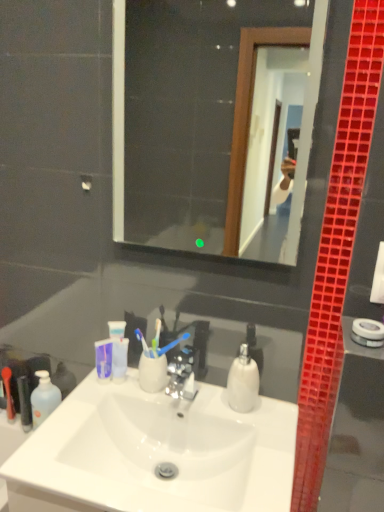
What is the approximate width of transparent glass mirror at upper center?

transparent glass mirror at upper center is 1.23 inches wide.

Describe the element at coordinates (243, 382) in the screenshot. Image resolution: width=384 pixels, height=512 pixels. I see `white glossy soap dispenser at center` at that location.

What do you see at coordinates (8, 393) in the screenshot? This screenshot has height=512, width=384. I see `rubberized red toothbrush at lower left, marked as the 2th toiletry in a right-to-left arrangement` at bounding box center [8, 393].

This screenshot has height=512, width=384. What do you see at coordinates (24, 403) in the screenshot? I see `black plastic tube at left, the second toiletry viewed from the left` at bounding box center [24, 403].

Locate an element on the screen. The image size is (384, 512). transparent glass mirror at upper center is located at coordinates (214, 123).

The image size is (384, 512). I want to click on mouthwash on the right of black plastic tube at left, the second toiletry viewed from the left, so click(44, 398).

Would you say translucent plastic mouthwash at lower left contains black plastic tube at left, the 1th toiletry when ordered from right to left?

No, black plastic tube at left, the 1th toiletry when ordered from right to left, is not a part of translucent plastic mouthwash at lower left.

Considering the sizes of objects translucent plastic mouthwash at lower left and black plastic tube at left, the second toiletry viewed from the left, in the image provided, who is thinner, translucent plastic mouthwash at lower left or black plastic tube at left, the second toiletry viewed from the left,?

With smaller width is translucent plastic mouthwash at lower left.

From a real-world perspective, is black plastic tube at left, the 1th toiletry when ordered from right to left, positioned under transparent glass mirror at upper center based on gravity?

Correct, in the physical world, black plastic tube at left, the 1th toiletry when ordered from right to left, is lower than transparent glass mirror at upper center.

Does black plastic tube at left, the second toiletry viewed from the left, have a lesser height compared to transparent glass mirror at upper center?

Yes.

Is black plastic tube at left, the second toiletry viewed from the left, next to transparent glass mirror at upper center and touching it?

No, black plastic tube at left, the second toiletry viewed from the left, is not beside transparent glass mirror at upper center.

Which of these two, rubberized red toothbrush at lower left, which appears as the 1th toiletry when viewed from the left, or transparent glass mirror at upper center, is thinner?

transparent glass mirror at upper center is thinner.

From a real-world perspective, who is located lower, rubberized red toothbrush at lower left, which appears as the 1th toiletry when viewed from the left, or transparent glass mirror at upper center?

rubberized red toothbrush at lower left, which appears as the 1th toiletry when viewed from the left, from a real-world perspective.

In the scene shown: Considering their positions, is rubberized red toothbrush at lower left, which appears as the 1th toiletry when viewed from the left, located in front of or behind transparent glass mirror at upper center?

Visually, rubberized red toothbrush at lower left, which appears as the 1th toiletry when viewed from the left, is located behind transparent glass mirror at upper center.

Is rubberized red toothbrush at lower left, which appears as the 1th toiletry when viewed from the left, far from transparent glass mirror at upper center?

Indeed, rubberized red toothbrush at lower left, which appears as the 1th toiletry when viewed from the left, is not near transparent glass mirror at upper center.

Would you consider transparent glass mirror at upper center to be distant from white glossy sink at center?

transparent glass mirror at upper center is far away from white glossy sink at center.

From a real-world perspective, is transparent glass mirror at upper center positioned above or below white glossy sink at center?

From a real-world perspective, transparent glass mirror at upper center is physically above white glossy sink at center.

Where is `sink below the transparent glass mirror at upper center (from the image's perspective)`? The image size is (384, 512). sink below the transparent glass mirror at upper center (from the image's perspective) is located at coordinates (155, 453).

Is black plastic tube at left, the second toiletry viewed from the left, to the left of white plastic towel bar at right from the viewer's perspective?

Yes.

Does black plastic tube at left, the 1th toiletry when ordered from right to left, contain white plastic towel bar at right?

Definitely not — white plastic towel bar at right is not inside black plastic tube at left, the 1th toiletry when ordered from right to left.

From a real-world perspective, is black plastic tube at left, the 1th toiletry when ordered from right to left, above or below white plastic towel bar at right?

From a real-world perspective, black plastic tube at left, the 1th toiletry when ordered from right to left, is physically below white plastic towel bar at right.

There is a white plastic towel bar at right. Where is `the 2nd toiletry below it (from the image's perspective)`? Image resolution: width=384 pixels, height=512 pixels. the 2nd toiletry below it (from the image's perspective) is located at coordinates (24, 403).

In order to click on sink that is on the right side of rubberized red toothbrush at lower left, marked as the 2th toiletry in a right-to-left arrangement in this screenshot , I will do `click(155, 453)`.

Which is in front, point (102, 409) or point (9, 418)?

Point (102, 409)

Can you confirm if white glossy sink at center is positioned to the left of rubberized red toothbrush at lower left, marked as the 2th toiletry in a right-to-left arrangement?

Incorrect, white glossy sink at center is not on the left side of rubberized red toothbrush at lower left, marked as the 2th toiletry in a right-to-left arrangement.

Considering the relative sizes of white glossy sink at center and rubberized red toothbrush at lower left, which appears as the 1th toiletry when viewed from the left, in the image provided, is white glossy sink at center thinner than rubberized red toothbrush at lower left, which appears as the 1th toiletry when viewed from the left,?

No, white glossy sink at center is not thinner than rubberized red toothbrush at lower left, which appears as the 1th toiletry when viewed from the left.

Measure the distance between rubberized red toothbrush at lower left, which appears as the 1th toiletry when viewed from the left, and white plastic towel bar at right.

rubberized red toothbrush at lower left, which appears as the 1th toiletry when viewed from the left, is 3.78 feet away from white plastic towel bar at right.

From a real-world perspective, between rubberized red toothbrush at lower left, which appears as the 1th toiletry when viewed from the left, and white plastic towel bar at right, who is vertically lower?

rubberized red toothbrush at lower left, which appears as the 1th toiletry when viewed from the left, from a real-world perspective.

From the image's perspective, would you say rubberized red toothbrush at lower left, marked as the 2th toiletry in a right-to-left arrangement, is shown under white plastic towel bar at right?

Yes, from the image's perspective, rubberized red toothbrush at lower left, marked as the 2th toiletry in a right-to-left arrangement, is beneath white plastic towel bar at right.

Can you confirm if rubberized red toothbrush at lower left, which appears as the 1th toiletry when viewed from the left, is wider than white plastic towel bar at right?

Indeed, rubberized red toothbrush at lower left, which appears as the 1th toiletry when viewed from the left, has a greater width compared to white plastic towel bar at right.

You are a GUI agent. You are given a task and a screenshot of the screen. Output one action in this format:
    pyautogui.click(x=<x>, y=<y>)
    Task: Click on the mouthwash that is below the black plastic tube at left, the 1th toiletry when ordered from right to left (from the image's perspective)
    
    Given the screenshot: What is the action you would take?
    pyautogui.click(x=44, y=398)

From a real-world perspective, starting from the transparent glass mirror at upper center, which toiletry is the 1st one below it? Please provide its 2D coordinates.

[(24, 403)]

Based on their spatial positions, is black plastic tube at left, the 1th toiletry when ordered from right to left, or rubberized red toothbrush at lower left, which appears as the 1th toiletry when viewed from the left, further from white glossy soap dispenser at center?

Based on the image, rubberized red toothbrush at lower left, which appears as the 1th toiletry when viewed from the left, appears to be further to white glossy soap dispenser at center.

Looking at the image, which one is located closer to white plastic towel bar at right, white glossy sink at center or rubberized red toothbrush at lower left, marked as the 2th toiletry in a right-to-left arrangement?

white glossy sink at center lies closer to white plastic towel bar at right than the other object.

From the image, which object appears to be farther from transparent glass mirror at upper center, rubberized red toothbrush at lower left, which appears as the 1th toiletry when viewed from the left, or white glossy sink at center?

rubberized red toothbrush at lower left, which appears as the 1th toiletry when viewed from the left, is positioned further to the anchor transparent glass mirror at upper center.

When comparing their distances from transparent glass mirror at upper center, does white glossy soap dispenser at center or translucent plastic mouthwash at lower left seem further?

translucent plastic mouthwash at lower left is positioned further to the anchor transparent glass mirror at upper center.

From the picture: Which object lies further to the anchor point white glossy sink at center, rubberized red toothbrush at lower left, marked as the 2th toiletry in a right-to-left arrangement, or white plastic towel bar at right?

rubberized red toothbrush at lower left, marked as the 2th toiletry in a right-to-left arrangement.

When comparing their distances from white glossy sink at center, does transparent glass mirror at upper center or translucent plastic mouthwash at lower left seem further?

Based on the image, transparent glass mirror at upper center appears to be further to white glossy sink at center.

When comparing their distances from white glossy sink at center, does rubberized red toothbrush at lower left, marked as the 2th toiletry in a right-to-left arrangement, or black plastic tube at left, the second toiletry viewed from the left, seem closer?

black plastic tube at left, the second toiletry viewed from the left, is closer to white glossy sink at center.

Considering their positions, is black plastic tube at left, the second toiletry viewed from the left, positioned further to transparent glass mirror at upper center than rubberized red toothbrush at lower left, which appears as the 1th toiletry when viewed from the left?

rubberized red toothbrush at lower left, which appears as the 1th toiletry when viewed from the left, lies further to transparent glass mirror at upper center than the other object.

This screenshot has width=384, height=512. What are the coordinates of `mirror between black plastic tube at left, the 1th toiletry when ordered from right to left, and white plastic towel bar at right` in the screenshot? It's located at (214, 123).

Identify the location of soap dispenser between translucent plastic mouthwash at lower left and white plastic towel bar at right from left to right. Image resolution: width=384 pixels, height=512 pixels. (243, 382).

Where is `soap dispenser between transparent glass mirror at upper center and translucent plastic mouthwash at lower left in the vertical direction`? The height and width of the screenshot is (512, 384). soap dispenser between transparent glass mirror at upper center and translucent plastic mouthwash at lower left in the vertical direction is located at coordinates (243, 382).

This screenshot has width=384, height=512. Identify the location of toiletry located between rubberized red toothbrush at lower left, which appears as the 1th toiletry when viewed from the left, and white glossy soap dispenser at center in the left-right direction. (24, 403).